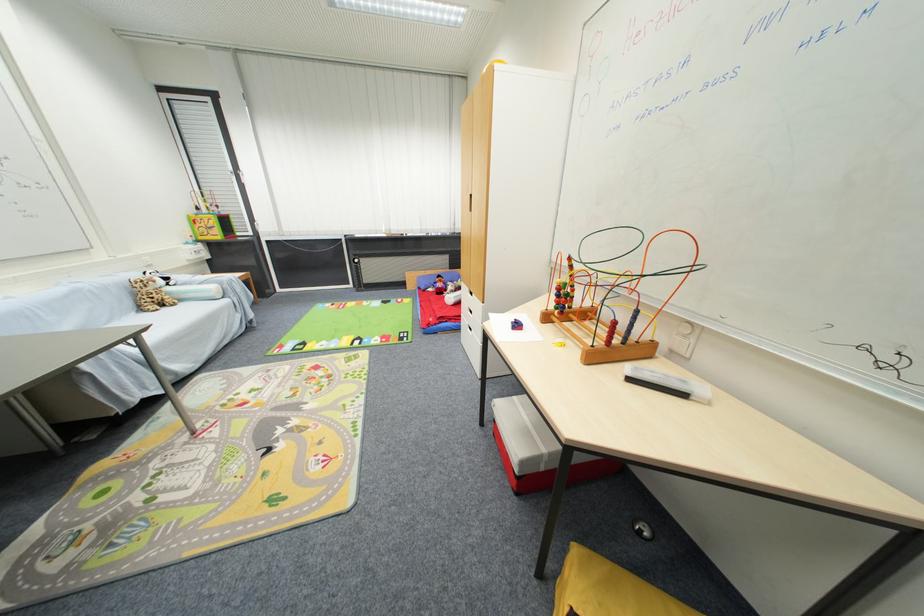
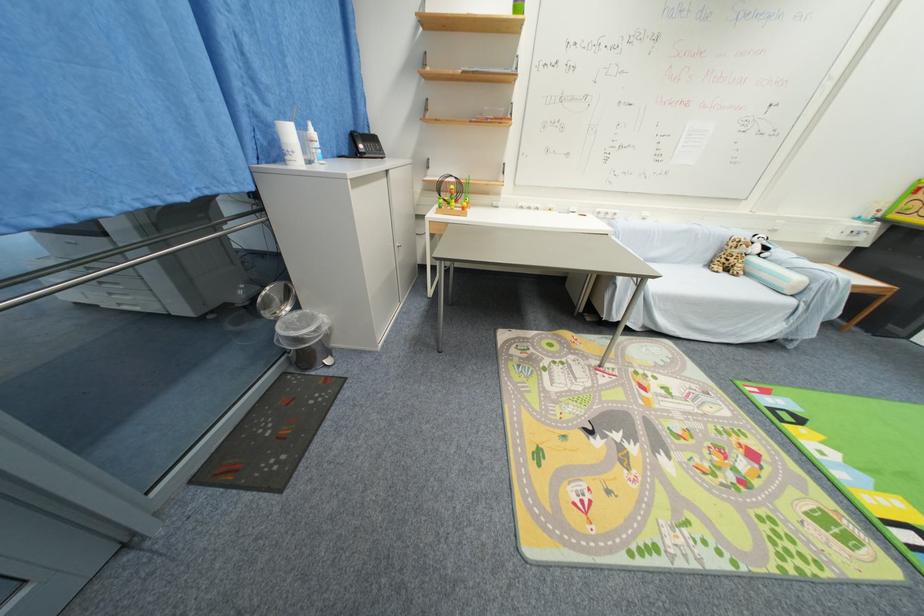
Find the pixel in the second image that matches [171,310] in the first image.

(730, 276)